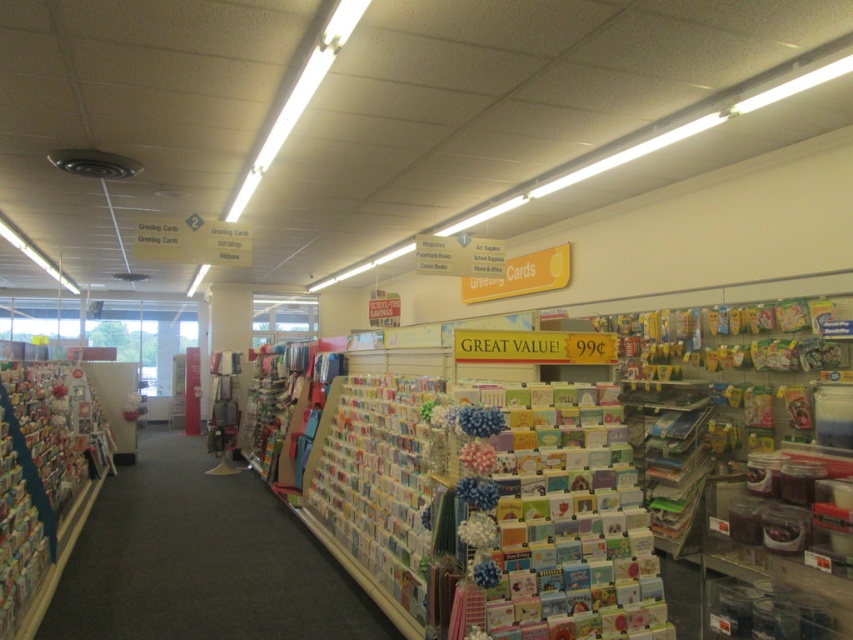
You are standing in the greeting card section of the store and notice two points marked on the floor. The first point is at coordinate point (x=270, y=544) and the second is at point (x=100, y=468). If you want to place a new display stand closer to your current position, which point should you choose?

Point (x=270, y=544) is closer to the camera than point (x=100, y=468), so you should choose point (x=270, y=544) to place the new display stand closer to your current position.